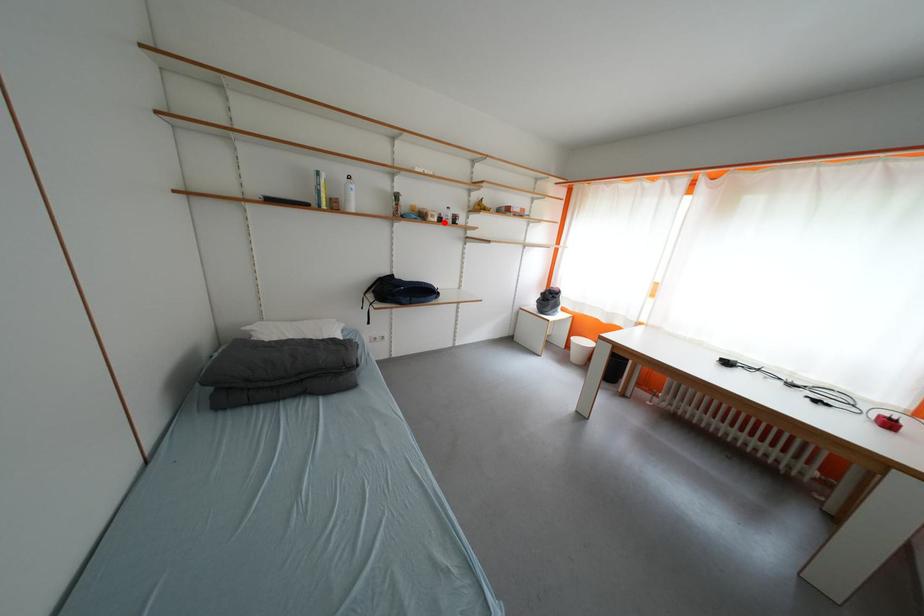
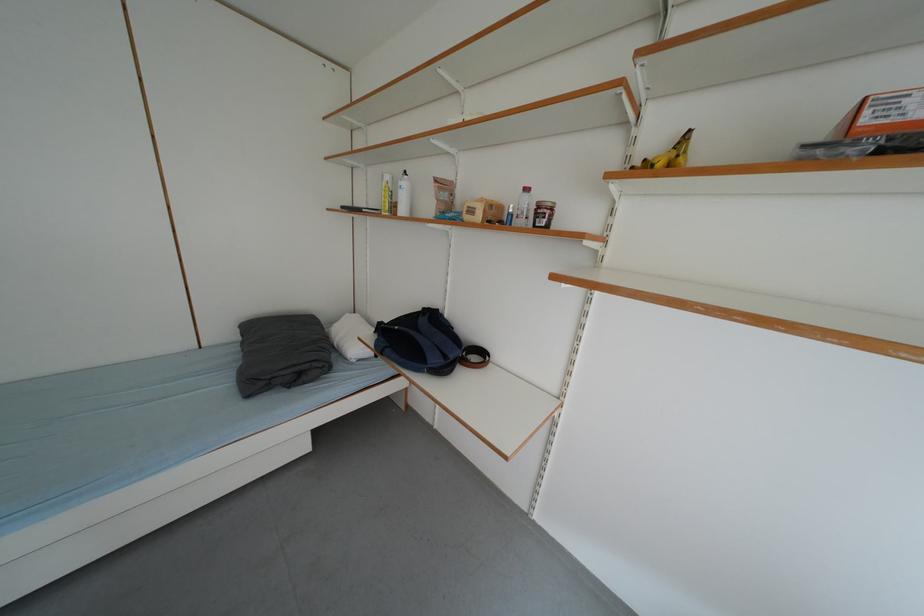
Question: I am providing you with two images of the same scene from different viewpoints. In image1, a red point is highlighted. Considering the same 3D point in image2, which of the following is correct?

Choices:
 (A) It is closer
 (B) It is farther

Answer: (B)